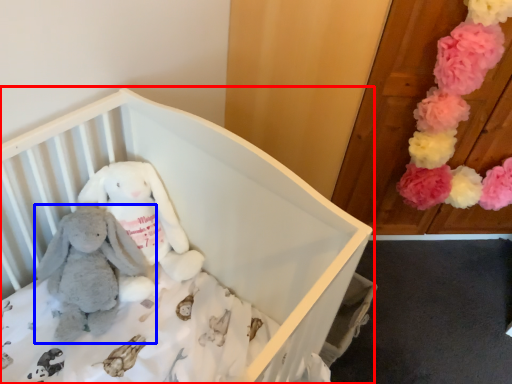
Question: Which point is closer to the camera, infant bed (highlighted by a red box) or toy (highlighted by a blue box)?

Choices:
 (A) infant bed
 (B) toy

Answer: (A)